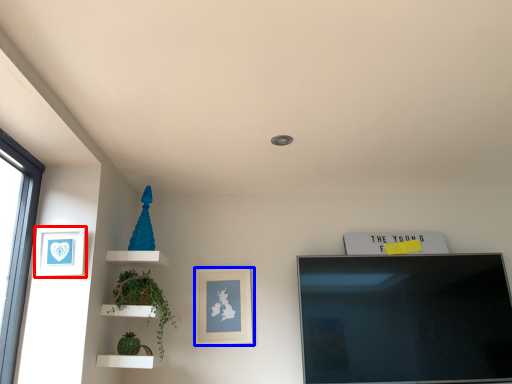
Question: Which object appears closest to the camera in this image, picture frame (highlighted by a red box) or picture frame (highlighted by a blue box)?

Choices:
 (A) picture frame
 (B) picture frame

Answer: (A)